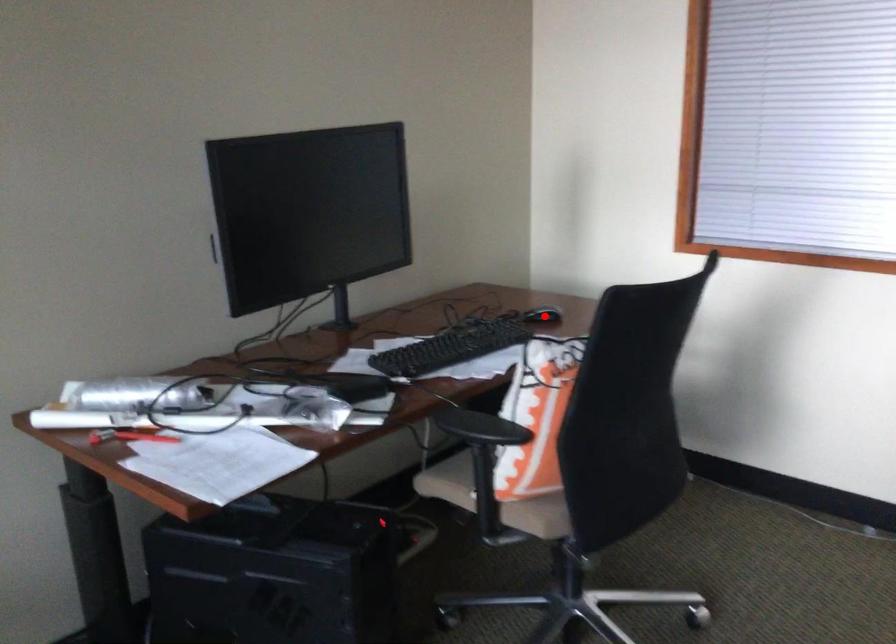
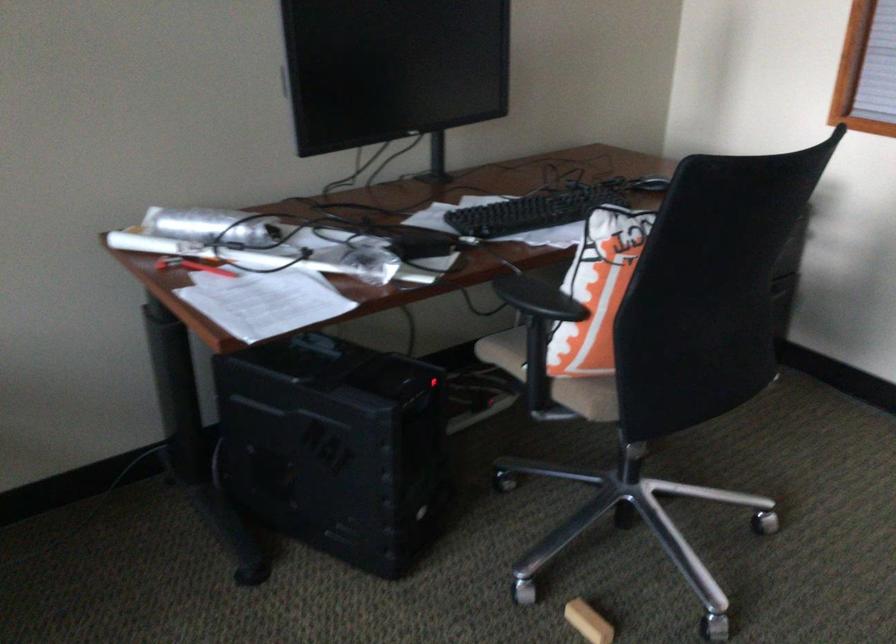
Question: A red point is marked in image1. In image2, is the corresponding 3D point closer to the camera or farther? Reply with the corresponding letter.

Choices:
 (A) The corresponding 3D point is closer.
 (B) The corresponding 3D point is farther.

Answer: (A)